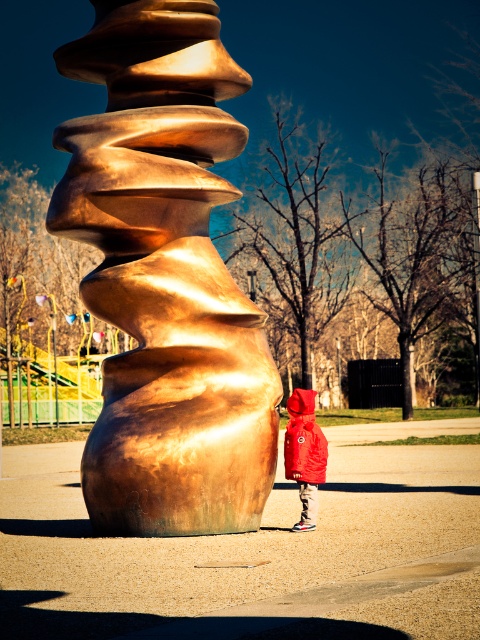
Question: Which object is closer to the camera taking this photo?

Choices:
 (A) matte red jacket at center
 (B) gold polished spiral at center

Answer: (B)

Question: Observing the image, what is the correct spatial positioning of gold polished spiral at center in reference to matte red jacket at center?

Choices:
 (A) left
 (B) right

Answer: (A)

Question: Observing the image, what is the correct spatial positioning of gold polished spiral at center in reference to matte red jacket at center?

Choices:
 (A) below
 (B) above

Answer: (B)

Question: Is gold polished spiral at center wider than matte red jacket at center?

Choices:
 (A) yes
 (B) no

Answer: (A)

Question: Which point is farther to the camera?

Choices:
 (A) gold polished spiral at center
 (B) matte red jacket at center

Answer: (B)